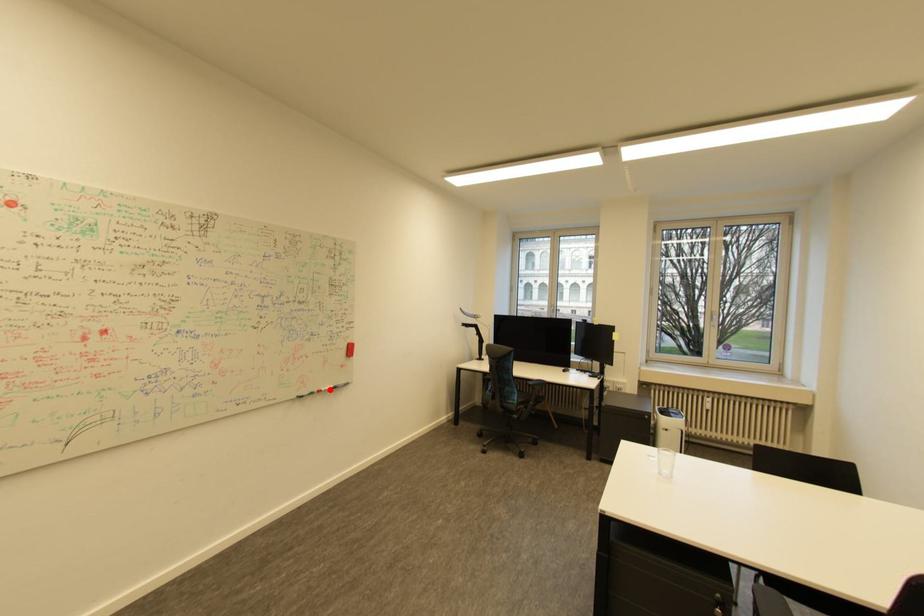
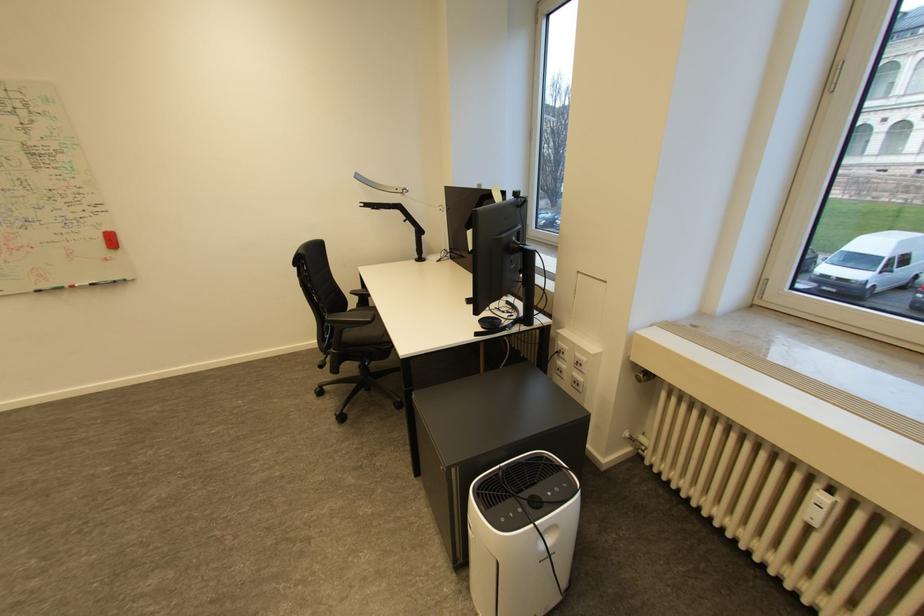
Question: I am providing you with two images of the same scene from different viewpoints. Given a red point in image1, look at the same physical point in image2. Is it:

Choices:
 (A) Closer to the viewpoint
 (B) Farther from the viewpoint

Answer: (B)